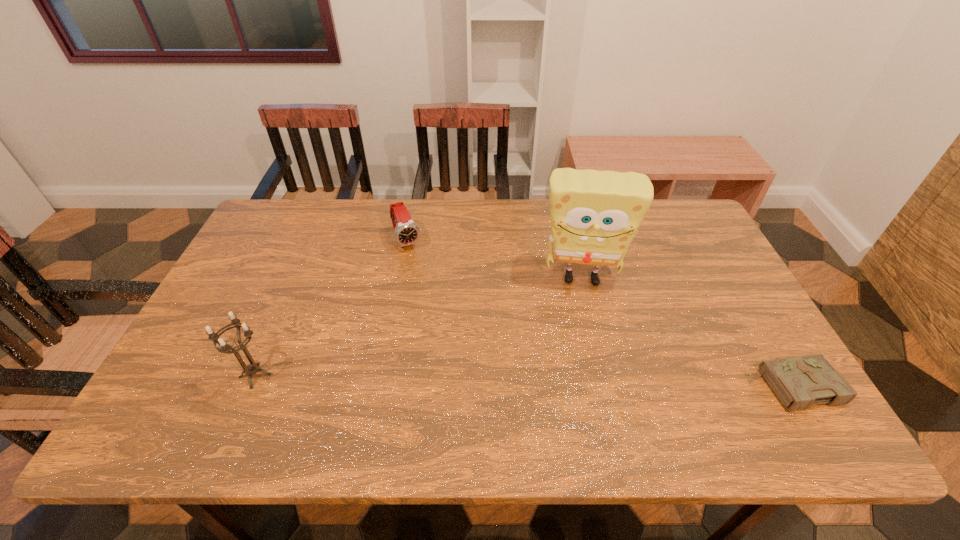
The image size is (960, 540). I want to click on free space on the desktop that is between the leftmost object and the rightmost object and is positioned on the face of the third object from left to right, so click(x=588, y=382).

Where is `vacant space on the desktop that is between the candle holder and the diary and is positioned on the face of the farthest object`? This screenshot has height=540, width=960. vacant space on the desktop that is between the candle holder and the diary and is positioned on the face of the farthest object is located at coordinates (483, 380).